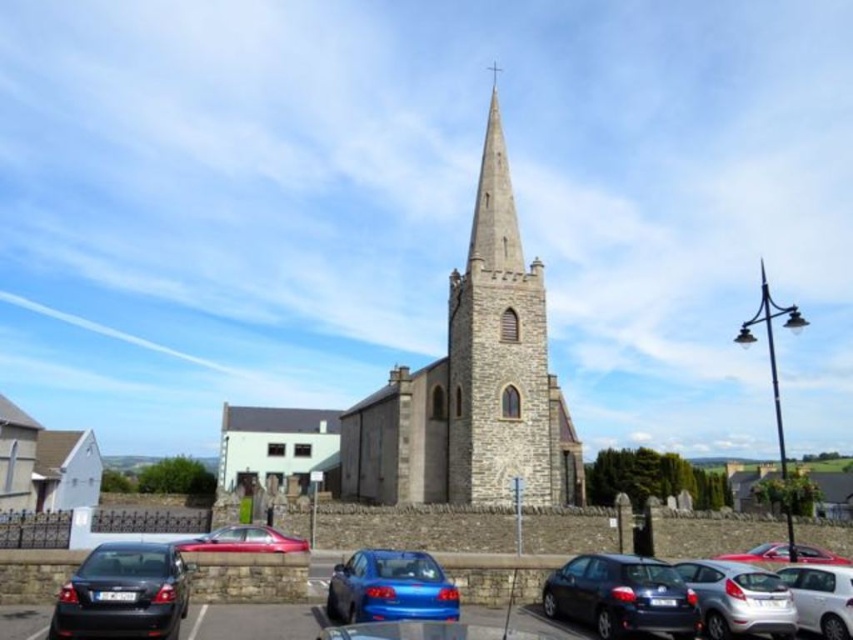
You are a photographer setting up equipment in the parking lot. You need to position your tripod between the matte black car at lower right and the glossy metallic car at lower left. Which car should you place the tripod closer to if you want to maximize the space available for your setup?

You should place the tripod closer to the matte black car at lower right because it is thinner than the glossy metallic car at lower left, providing more space between them.

You are standing in the parking lot and want to walk towards the gray stone steeple at center. Which direction should you head relative to the silver metallic hatchback at lower right?

The gray stone steeple at center is to the left of the silver metallic hatchback at lower right, so you should head left relative to the hatchback to reach the steeple.

You are a photographer planning to take a wide shot of the gray stone steeple at center and the silver metallic hatchback at lower right. Based on their sizes, which object should you focus on first to ensure it appears prominently in the frame?

The gray stone steeple at center has a larger size compared to the silver metallic hatchback at lower right, so you should focus on the gray stone steeple at center first to ensure it appears prominently in the frame.